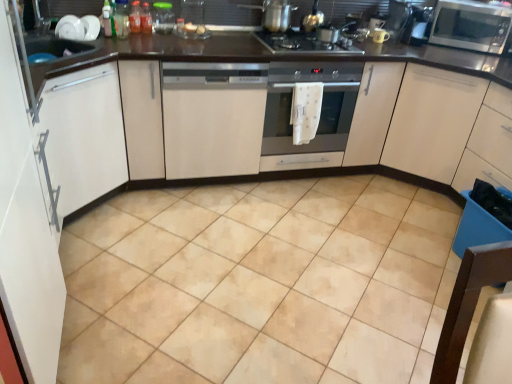
Find the location of a particular element. The width and height of the screenshot is (512, 384). vacant region in front of transparent plastic container at upper center, which is counted as the third appliance, starting from the right is located at coordinates (157, 41).